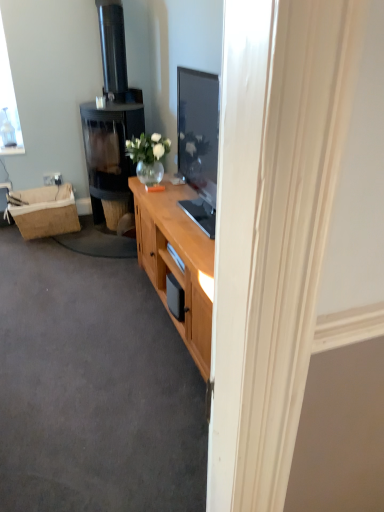
From the picture: Measure the distance between burlap picnic basket at left and camera.

The depth of burlap picnic basket at left is 3.29 meters.

Image resolution: width=384 pixels, height=512 pixels. What do you see at coordinates (46, 211) in the screenshot?
I see `burlap picnic basket at left` at bounding box center [46, 211].

Find the location of a particular element. black glass fireplace at left is located at coordinates (111, 122).

The width and height of the screenshot is (384, 512). What are the coordinates of `burlap picnic basket at left` in the screenshot? It's located at (46, 211).

From the picture: Would you say burlap picnic basket at left is a long distance from black glass fireplace at left?

Actually, burlap picnic basket at left and black glass fireplace at left are a little close together.

Does burlap picnic basket at left lie behind black glass fireplace at left?

Answer: Yes, burlap picnic basket at left is further from the camera.

Does burlap picnic basket at left turn towards black glass fireplace at left?

No, burlap picnic basket at left is not facing towards black glass fireplace at left.

Between burlap picnic basket at left and black glass fireplace at left, which one has smaller size?

burlap picnic basket at left.

Locate an element on the screen. plain that appears below the black glass fireplace at left (from the image's perspective) is located at coordinates tap(93, 388).

Looking at their sizes, would you say black glass fireplace at left is wider or thinner than wooden cabinet at center?

Clearly, black glass fireplace at left has less width compared to wooden cabinet at center.

What's the angular difference between black glass fireplace at left and wooden cabinet at center's facing directions?

The angle between the facing direction of black glass fireplace at left and the facing direction of wooden cabinet at center is 0.397 degrees.

Consider the image. From the image's perspective, which one is positioned lower, black glass fireplace at left or wooden cabinet at center?

wooden cabinet at center.

Looking at this image, who is shorter, black glass fireplace at left or burlap picnic basket at left?

burlap picnic basket at left is shorter.

From a real-world perspective, is black glass fireplace at left on burlap picnic basket at left?

Yes, from a real-world perspective, black glass fireplace at left is above burlap picnic basket at left.

Is black glass fireplace at left bigger than burlap picnic basket at left?

Yes, black glass fireplace at left is bigger than burlap picnic basket at left.

Which is more to the right, burlap picnic basket at left or wooden cabinet at center?

wooden cabinet at center.

From a real-world perspective, does burlap picnic basket at left stand above wooden cabinet at center?

Correct, in the physical world, burlap picnic basket at left is higher than wooden cabinet at center.

Considering the positions of point (46, 227) and point (92, 367), is point (46, 227) closer or farther from the camera than point (92, 367)?

Point (46, 227) is positioned farther from the camera compared to point (92, 367).

Can you confirm if burlap picnic basket at left is thinner than wooden cabinet at center?

Yes, burlap picnic basket at left is thinner than wooden cabinet at center.

Looking at this image, considering the relative sizes of wooden cabinet at center and black glass fireplace at left in the image provided, is wooden cabinet at center smaller than black glass fireplace at left?

Indeed, wooden cabinet at center has a smaller size compared to black glass fireplace at left.

Can you confirm if wooden cabinet at center is taller than black glass fireplace at left?

No.

Considering the sizes of wooden cabinet at center and black glass fireplace at left in the image, is wooden cabinet at center wider or thinner than black glass fireplace at left?

Clearly, wooden cabinet at center has more width compared to black glass fireplace at left.

From the picture: Does wooden cabinet at center have a lesser height compared to burlap picnic basket at left?

Yes.

How many degrees apart are the facing directions of wooden cabinet at center and burlap picnic basket at left?

89.6 degrees separate the facing orientations of wooden cabinet at center and burlap picnic basket at left.

Where is `picnic basket located above the wooden cabinet at center (from a real-world perspective)`? This screenshot has height=512, width=384. picnic basket located above the wooden cabinet at center (from a real-world perspective) is located at coordinates (46, 211).

From the image's perspective, is wooden cabinet at center above or below burlap picnic basket at left?

wooden cabinet at center is situated lower than burlap picnic basket at left in the image.

Locate an element on the screen. The image size is (384, 512). picnic basket behind the black glass fireplace at left is located at coordinates (46, 211).

Find the location of `plain in front of the black glass fireplace at left`. plain in front of the black glass fireplace at left is located at coordinates pos(93,388).

Which object lies nearer to the anchor point black glass fireplace at left, burlap picnic basket at left or wooden cabinet at center?

burlap picnic basket at left.

Based on the photo, which object lies nearer to the anchor point wooden cabinet at center, burlap picnic basket at left or black glass fireplace at left?

burlap picnic basket at left is closer to wooden cabinet at center.

Which object lies nearer to the anchor point wooden cabinet at center, black glass fireplace at left or burlap picnic basket at left?

burlap picnic basket at left lies closer to wooden cabinet at center than the other object.

Looking at the image, which one is located closer to black glass fireplace at left, wooden cabinet at center or burlap picnic basket at left?

burlap picnic basket at left is closer to black glass fireplace at left.

Looking at the image, which one is located further to burlap picnic basket at left, black glass fireplace at left or wooden cabinet at center?

wooden cabinet at center is positioned further to the anchor burlap picnic basket at left.

Looking at the image, which one is located closer to burlap picnic basket at left, wooden cabinet at center or black glass fireplace at left?

The object closer to burlap picnic basket at left is black glass fireplace at left.

Locate an element on the screen. fireplace between wooden cabinet at center and burlap picnic basket at left from front to back is located at coordinates (111, 122).